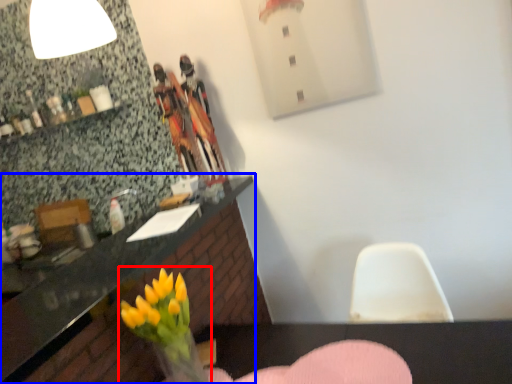
Question: Which object is further to the camera taking this photo, floral arrangement (highlighted by a red box) or countertop (highlighted by a blue box)?

Choices:
 (A) floral arrangement
 (B) countertop

Answer: (A)